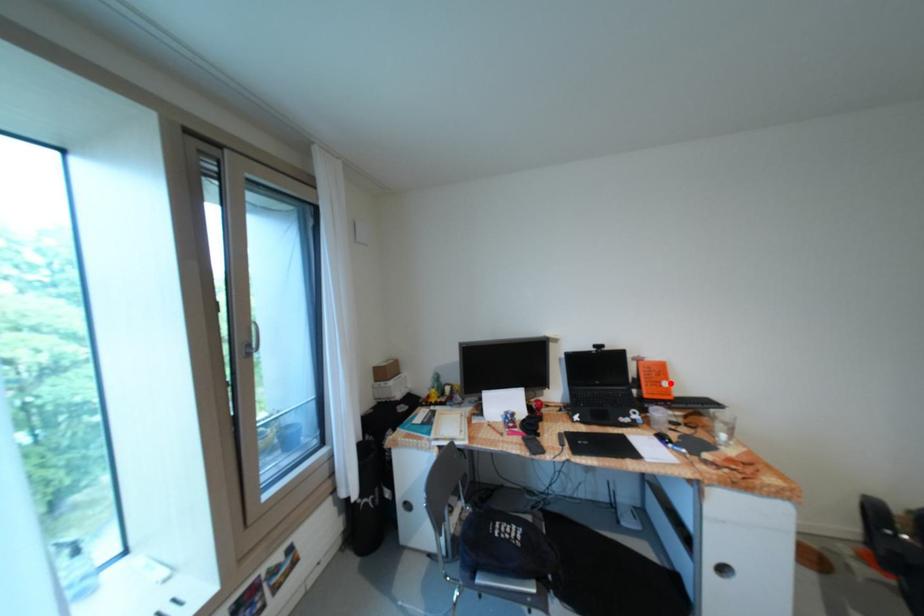
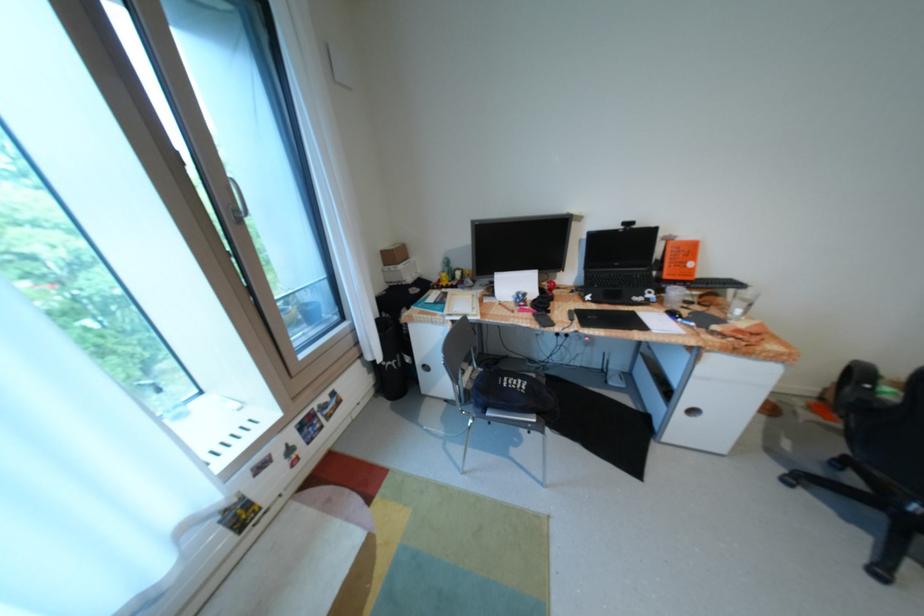
In the second image, find the point that corresponds to the highlighted location in the first image.

(697, 264)